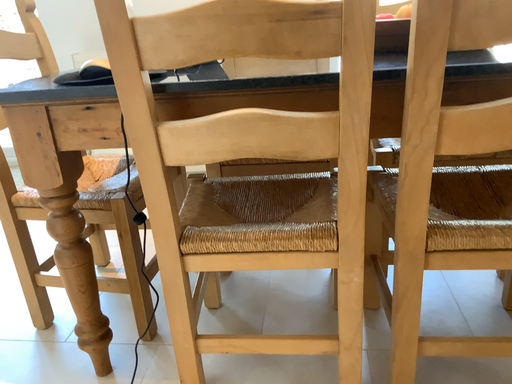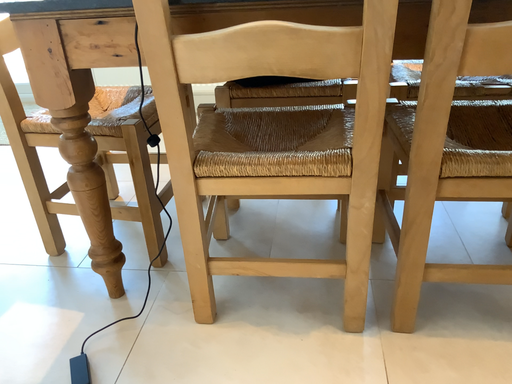
Question: How did the camera likely rotate when shooting the video?

Choices:
 (A) rotated upward
 (B) rotated downward

Answer: (B)